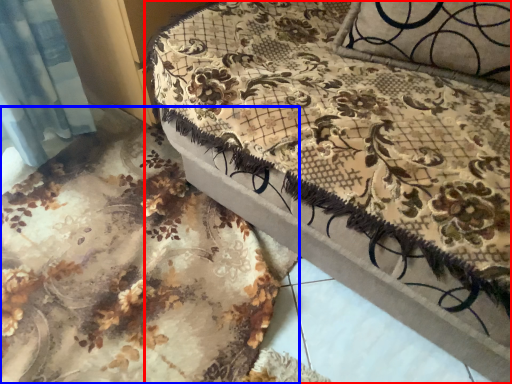
Question: Which object appears closest to the camera in this image, furniture (highlighted by a red box) or bed frame (highlighted by a blue box)?

Choices:
 (A) furniture
 (B) bed frame

Answer: (A)